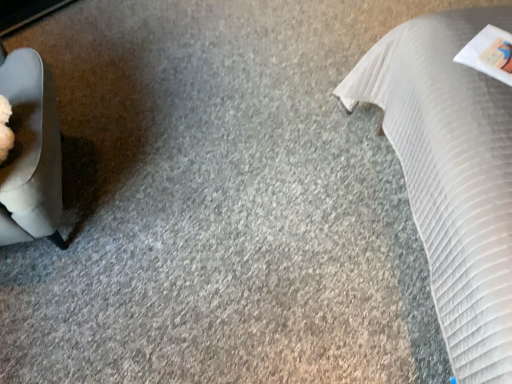
In order to click on white paper at upper right in this screenshot , I will do coord(489,53).

What do you see at coordinates (489, 53) in the screenshot?
I see `white paper at upper right` at bounding box center [489, 53].

At what (x,y) coordinates should I click in order to perform the action: click on white paper at upper right. Please return your answer as a coordinate pair (x, y). The image size is (512, 384). Looking at the image, I should click on (489, 53).